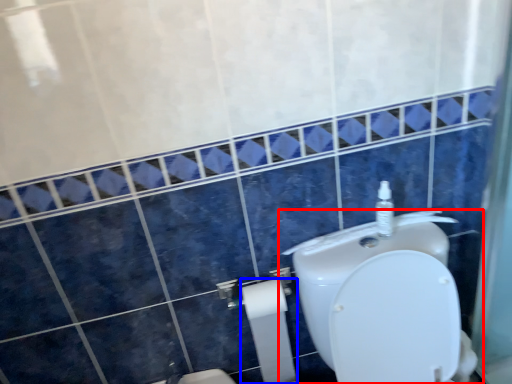
Question: Which object is closer to the camera taking this photo, toilet (highlighted by a red box) or toilet paper (highlighted by a blue box)?

Choices:
 (A) toilet
 (B) toilet paper

Answer: (A)